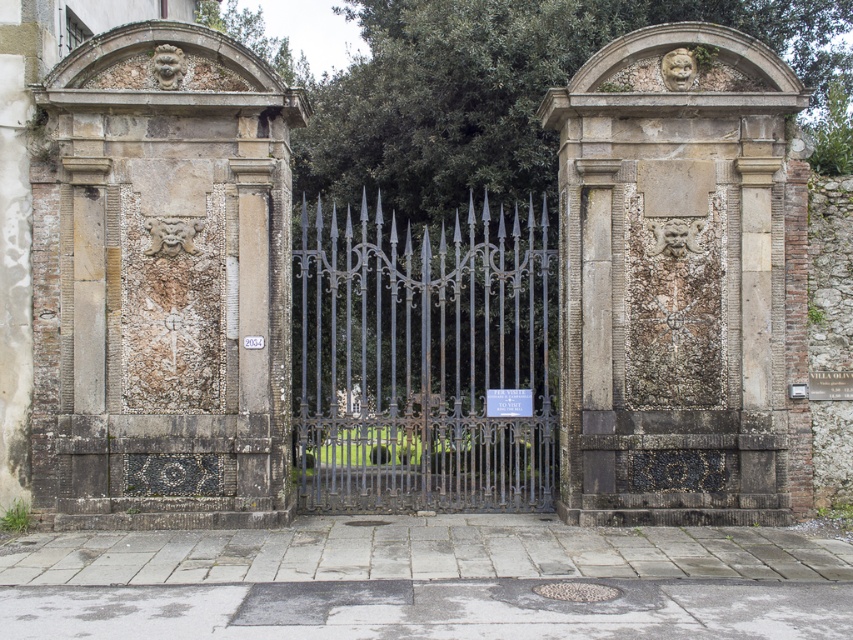
You are standing at the center of the grand entrance gate. Which direction should you look to see the stone mosaic wall at left?

The stone mosaic wall at left is located at the left side of the entrance, so you should look to your left to see it.

You are standing at the entrance of the grand gate and want to walk towards the two points marked in the image. Which point would you reach first, point (123, 452) or point (373, 304)?

Point (123, 452) is in front of point (373, 304), so you would reach point (123, 452) first.